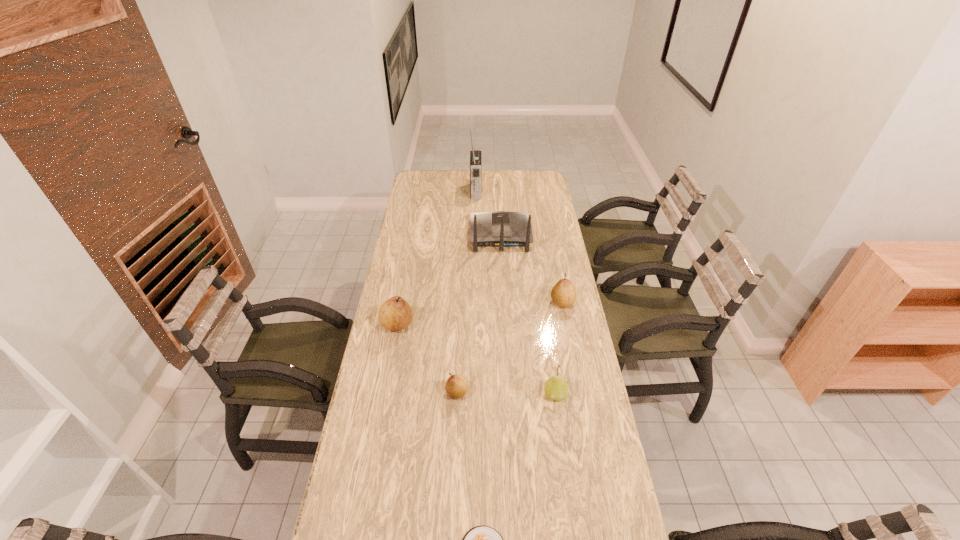
Locate an element on the screen. This screenshot has width=960, height=540. radio receiver is located at coordinates tap(475, 155).

You are a GUI agent. You are given a task and a screenshot of the screen. Output one action in this format:
    pyautogui.click(x=<x>, y=<y>)
    Task: Click on the farthest object
    
    Given the screenshot: What is the action you would take?
    pyautogui.click(x=475, y=155)

Locate an element on the screen. the sixth nearest object is located at coordinates (501, 229).

The image size is (960, 540). I want to click on router, so click(x=501, y=229).

At what (x,y) coordinates should I click in order to perform the action: click on the fourth farthest object. Please return your answer as a coordinate pair (x, y). The width and height of the screenshot is (960, 540). Looking at the image, I should click on (395, 314).

The width and height of the screenshot is (960, 540). Find the location of `the leftmost brown pear`. the leftmost brown pear is located at coordinates (395, 314).

This screenshot has height=540, width=960. In order to click on the farthest pear in this screenshot , I will do `click(563, 294)`.

Where is `the rightmost brown pear`? Image resolution: width=960 pixels, height=540 pixels. the rightmost brown pear is located at coordinates (563, 294).

You are a GUI agent. You are given a task and a screenshot of the screen. Output one action in this format:
    pyautogui.click(x=<x>, y=<y>)
    Task: Click on the green pear
    Image resolution: width=960 pixels, height=540 pixels.
    Given the screenshot: What is the action you would take?
    tap(556, 388)

Identify the location of the second brown pear from left to right. This screenshot has height=540, width=960. (456, 386).